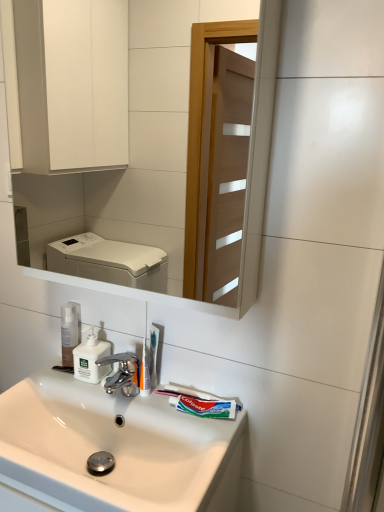
Locate an element on the screen. free location in front of transparent plastic pump bottle at center is located at coordinates (62, 383).